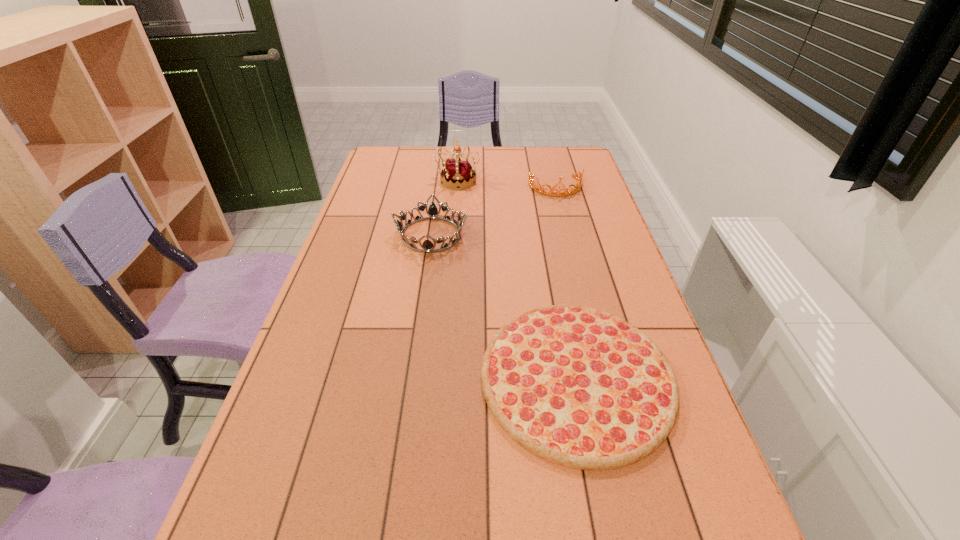
In order to click on object that is positioned at the left edge in this screenshot , I will do `click(432, 212)`.

At what (x,y) coordinates should I click in order to perform the action: click on tiara that is at the right edge. Please return your answer as a coordinate pair (x, y). This screenshot has width=960, height=540. Looking at the image, I should click on (542, 190).

Find the location of a particular element. The image size is (960, 540). pizza located in the right edge section of the desktop is located at coordinates (579, 387).

This screenshot has height=540, width=960. I want to click on free spot at the far edge of the desktop, so click(x=420, y=171).

In the image, there is a desktop. At what (x,y) coordinates should I click in order to perform the action: click on vacant space at the left edge. Please return your answer as a coordinate pair (x, y). This screenshot has height=540, width=960. Looking at the image, I should click on (375, 229).

Where is `free region at the right edge of the desktop`? free region at the right edge of the desktop is located at coordinates (624, 307).

The width and height of the screenshot is (960, 540). What are the coordinates of `vacant position at the far left corner of the desktop` in the screenshot? It's located at (389, 166).

You are a GUI agent. You are given a task and a screenshot of the screen. Output one action in this format:
    pyautogui.click(x=<x>, y=<y>)
    Task: Click on the empty space that is in between the rightmost tiara and the tallest tiara
    
    Given the screenshot: What is the action you would take?
    pyautogui.click(x=507, y=184)

Image resolution: width=960 pixels, height=540 pixels. What are the coordinates of `empty space that is in between the tallest tiara and the pizza` in the screenshot? It's located at (517, 279).

Where is `unoccupied position between the shortest object and the rightmost tiara`? unoccupied position between the shortest object and the rightmost tiara is located at coordinates (566, 282).